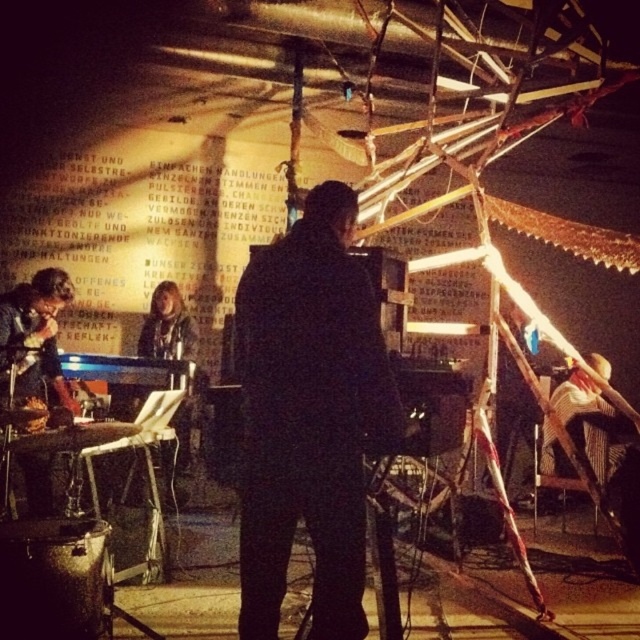
You are a photographer setting up for a live performance. You need to position a spotlight on the black matte jacket at center and another on the shiny black drum set at lower left. Which object requires a larger spotlight to fully illuminate it?

The shiny black drum set at lower left requires a larger spotlight because it is bigger in size compared to the black matte jacket at center.

Consider the image. You are a photographer positioned at the back of the room. You want to take a photo of the black matte jacket at center and the shiny black drum set at lower left. Which object will appear larger in your photo?

The black matte jacket at center will appear larger in the photo because it is closer to the viewer than the shiny black drum set at lower left.

Please provide the coordinates of the black matte jacket at center in the image. The coordinates should be in the format of a point with two decimal places, like this example format point format. The scene includes a person operating electronic equipment in a dimly lit room with two other people at a keyboard and microphone.

The coordinates of the black matte jacket at center are point (308, 416).